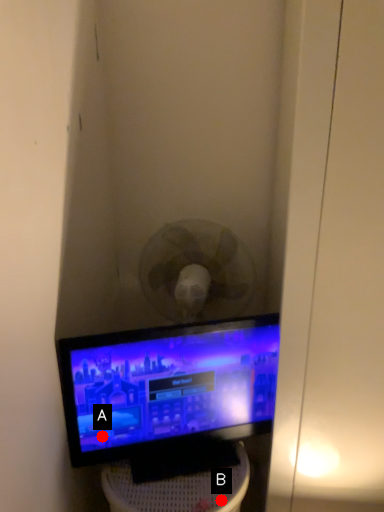
Question: Two points are circled on the image, labeled by A and B beside each circle. Which point is farther to the camera?

Choices:
 (A) A is further
 (B) B is further

Answer: (A)